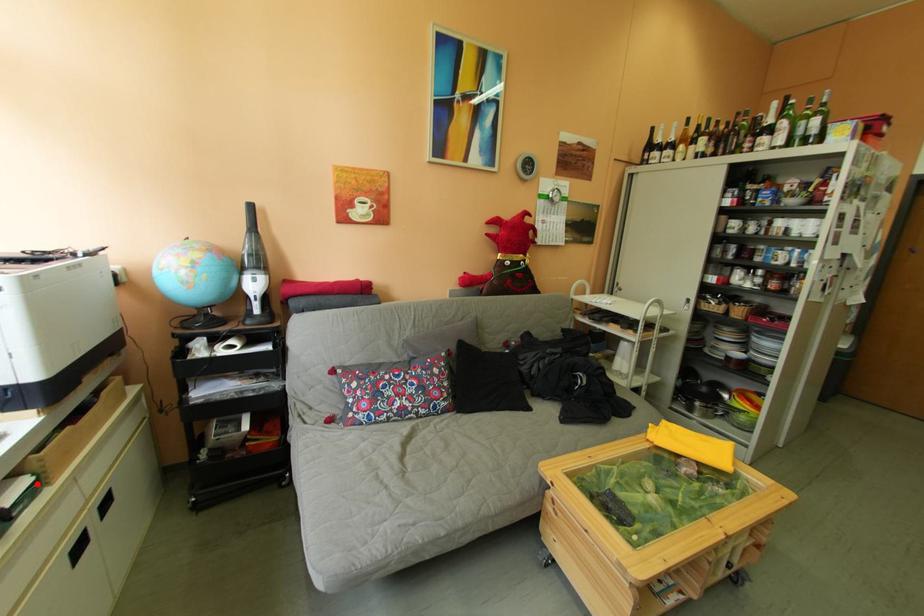
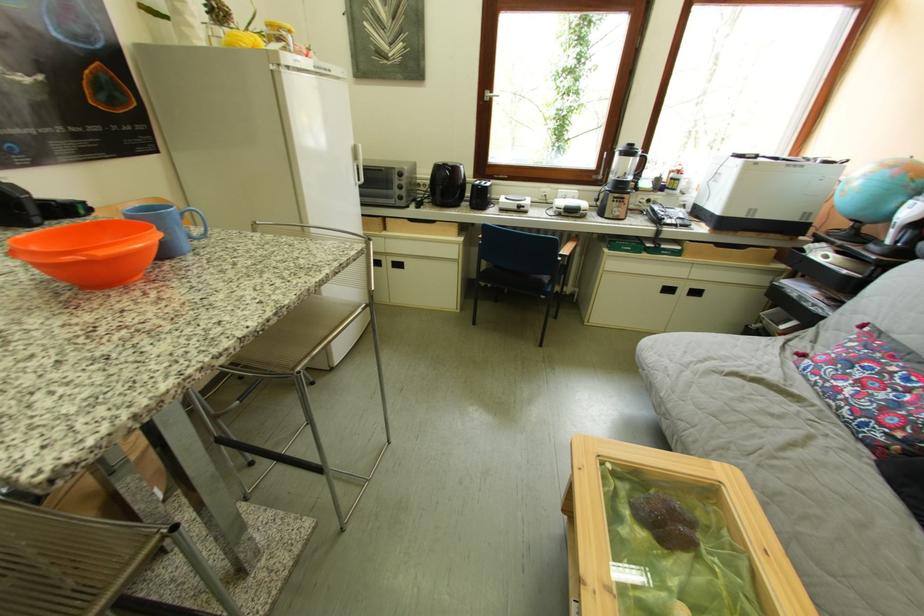
Question: I am providing you with two images of the same scene from different viewpoints. In image1, a red point is highlighted. Considering the same 3D point in image2, which of the following is correct?

Choices:
 (A) It is closer
 (B) It is farther

Answer: (A)